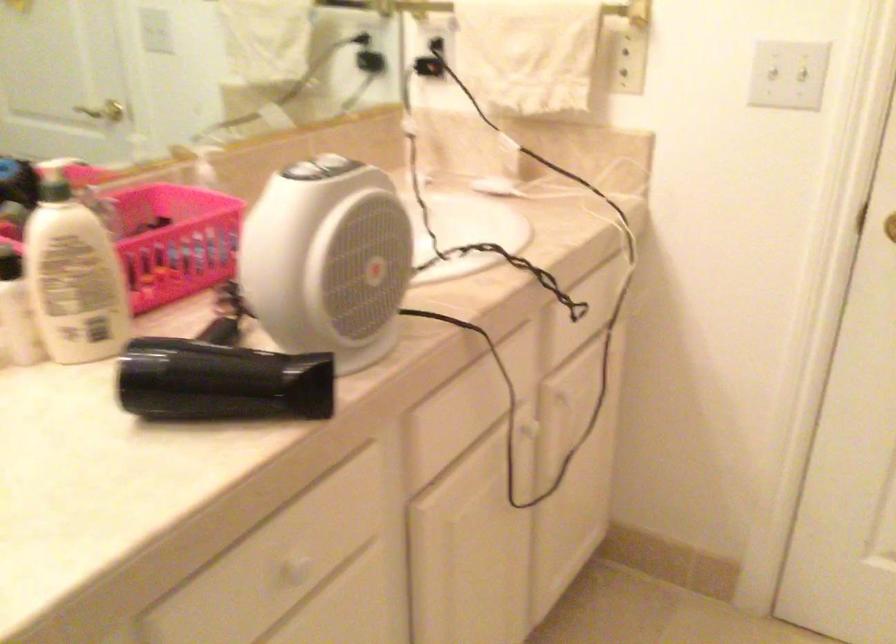
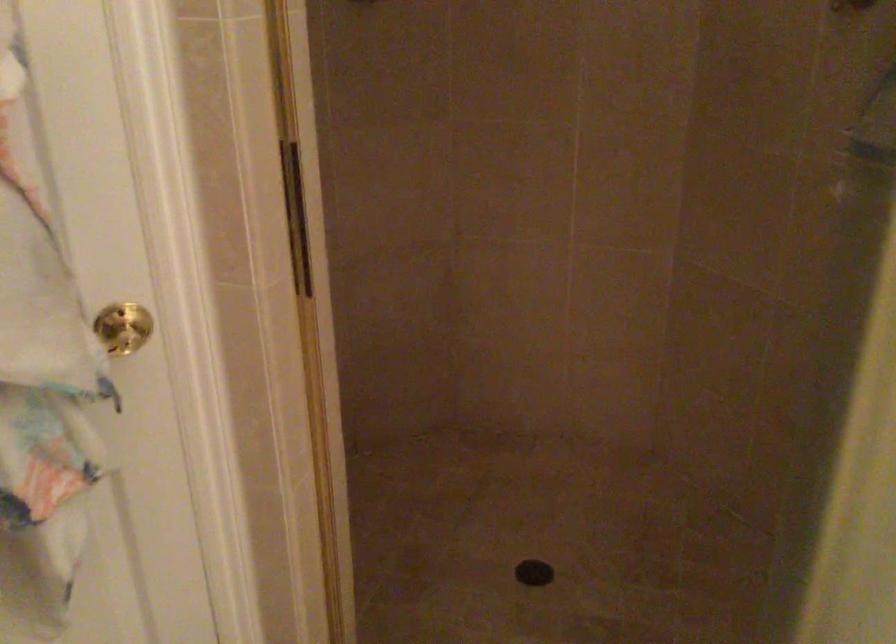
Based on the continuous images, in which direction is the camera rotating?

The camera's rotation is toward left-down.